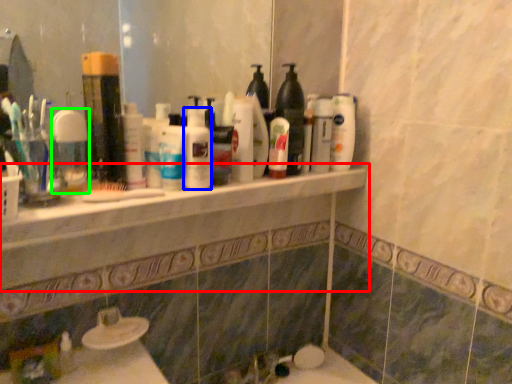
Question: Which is nearer to the counter top (highlighted by a red box)? cleaning product (highlighted by a blue box) or mouthwash (highlighted by a green box).

Choices:
 (A) cleaning product
 (B) mouthwash

Answer: (A)